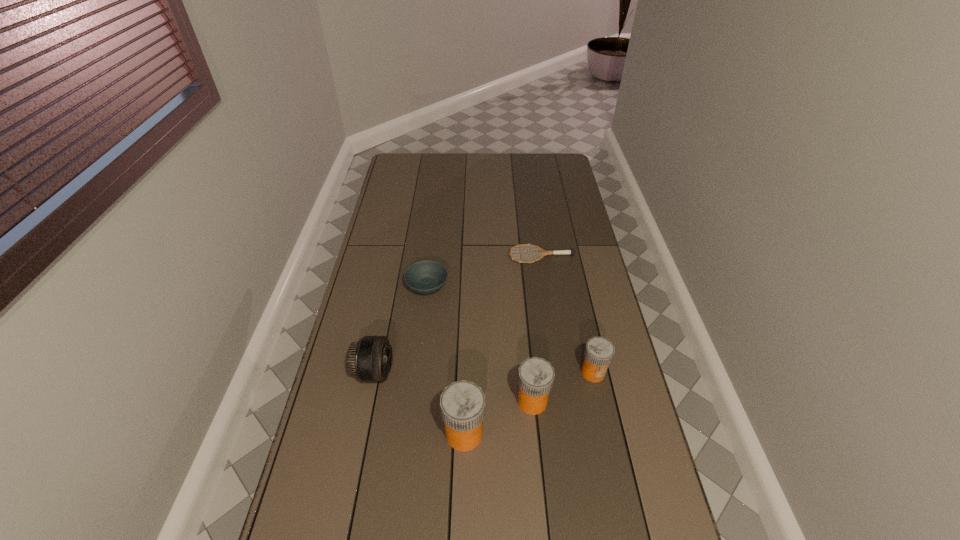
Please point a spot on the left to add another medicine. Please provide its 2D coordinates. Your answer should be formatted as a tuple, i.e. [(x, y)], where the tuple contains the x and y coordinates of a point satisfying the conditions above.

[(388, 470)]